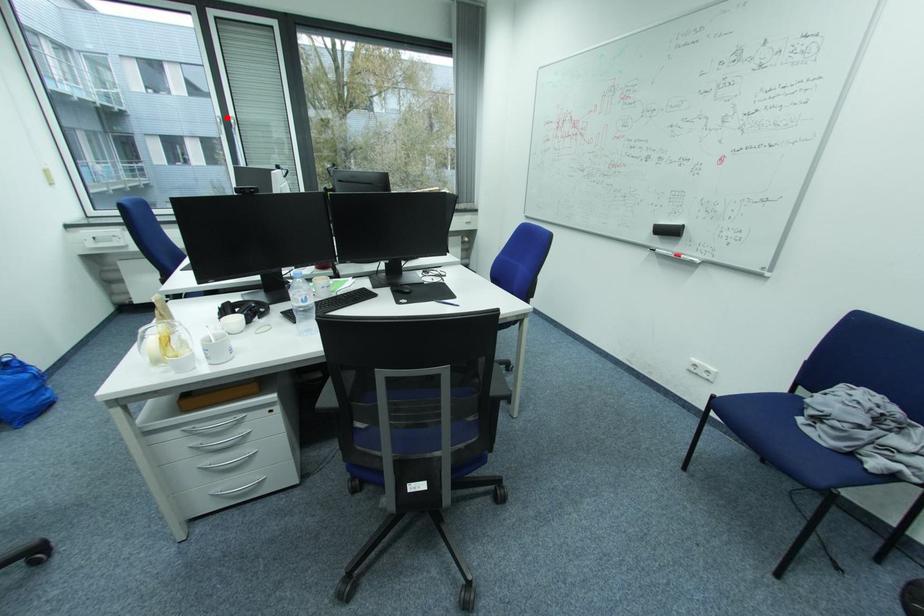
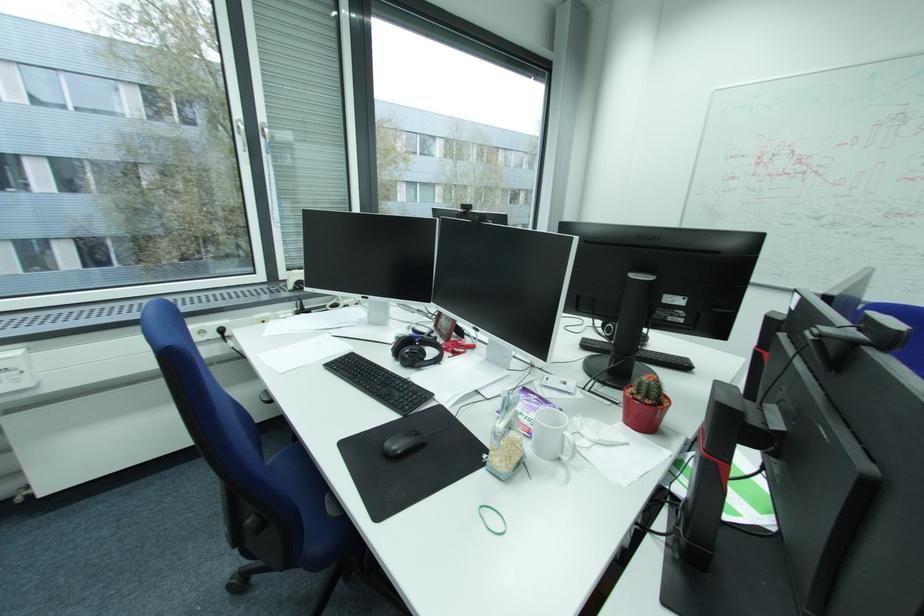
Question: I am providing you with two images of the same scene from different viewpoints. A red point is shown in image1. For the corresponding object point in image2, is it positioned nearer or farther from the camera?

Choices:
 (A) Nearer
 (B) Farther

Answer: (B)